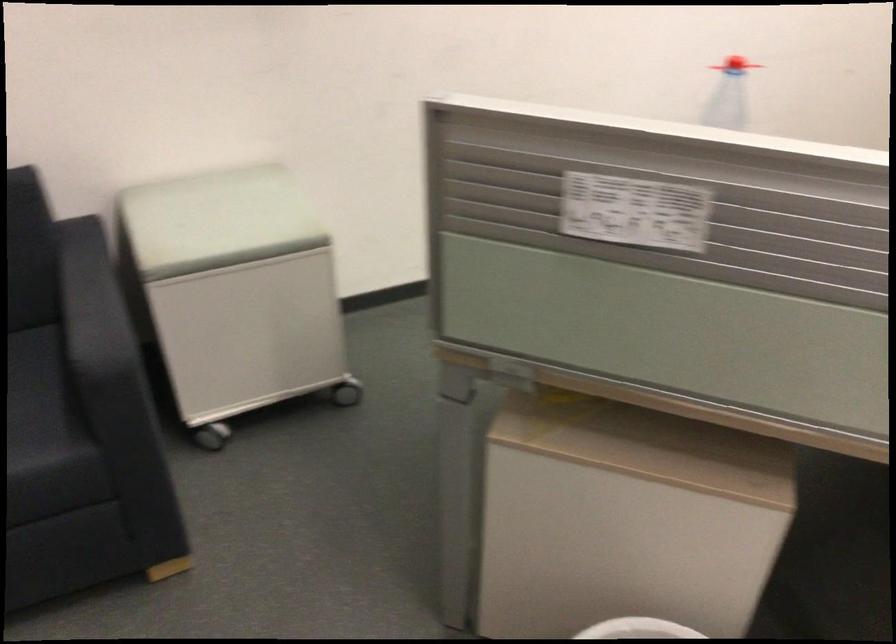
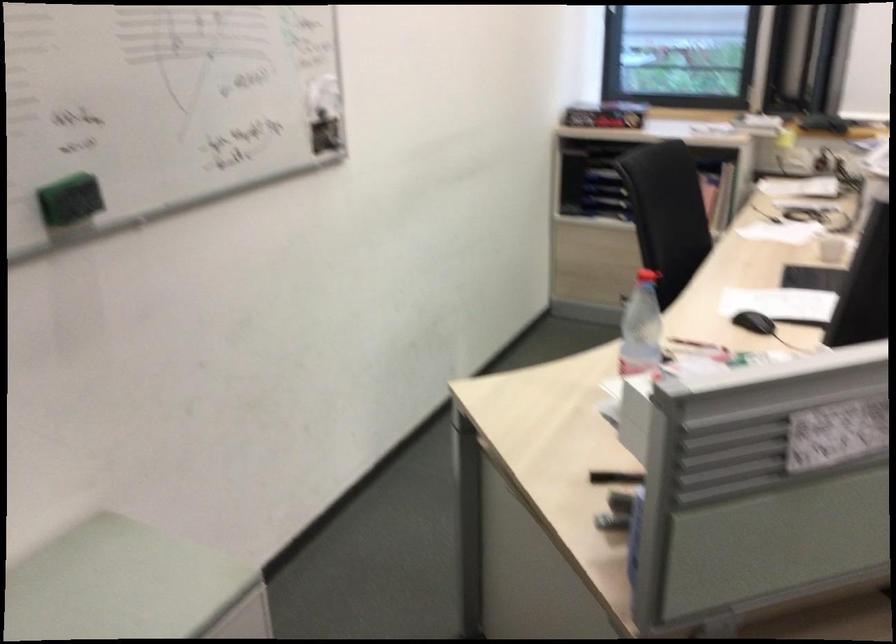
The point at (716, 122) is marked in the first image. Where is the corresponding point in the second image?

(641, 327)